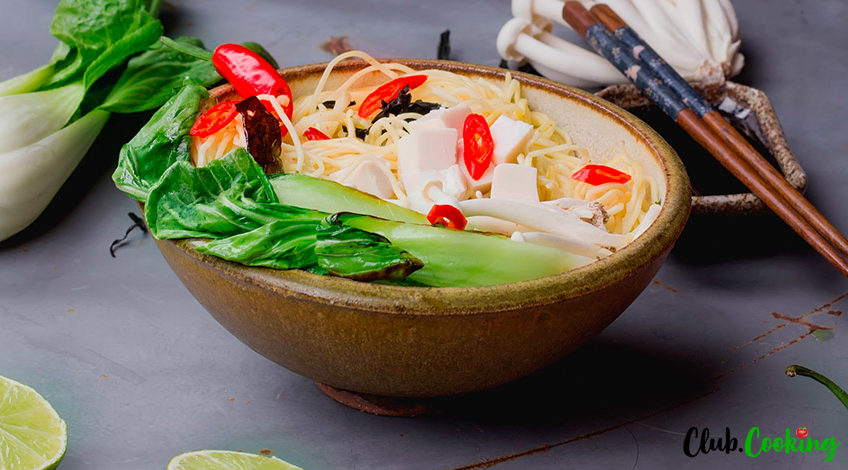
This screenshot has width=848, height=470. Identify the location of white bowl interior. (600, 136).